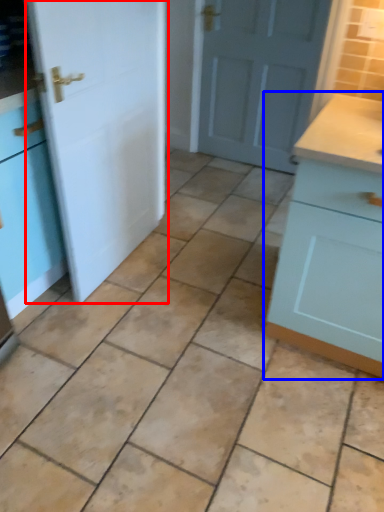
Question: Which of the following is the closest to the observer, door (highlighted by a red box) or cabinetry (highlighted by a blue box)?

Choices:
 (A) door
 (B) cabinetry

Answer: (B)